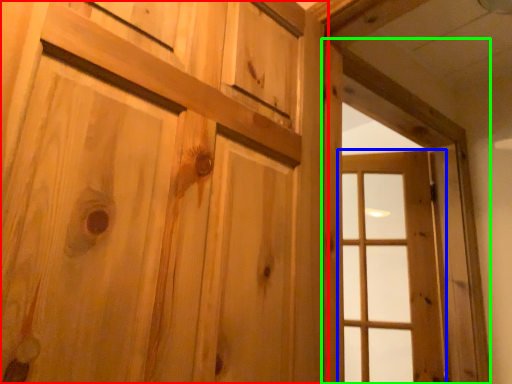
Question: Estimate the real-world distances between objects in this image. Which object is farther from door (highlighted by a red box), window (highlighted by a blue box) or window frame (highlighted by a green box)?

Choices:
 (A) window
 (B) window frame

Answer: (A)